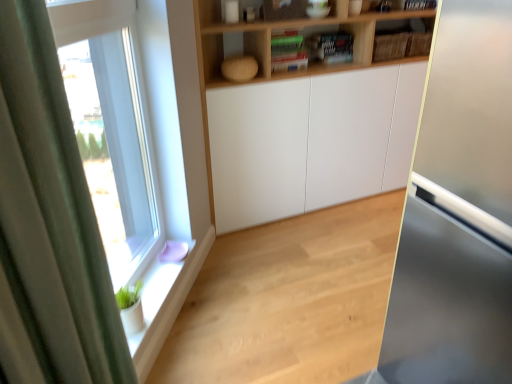
At what (x,y) coordinates should I click in order to perform the action: click on vacant region above white glossy window sill at lower left (from a real-world perspective). Please return your answer as a coordinate pair (x, y). Image resolution: width=512 pixels, height=384 pixels. Looking at the image, I should click on (175, 293).